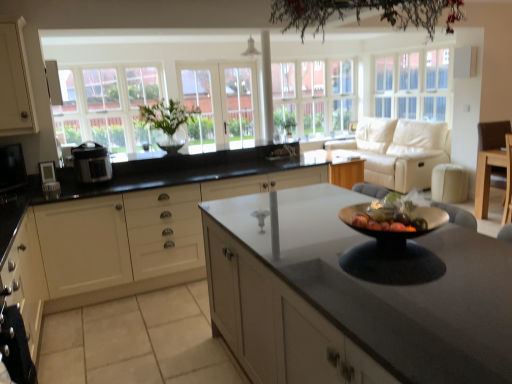
Question: Is white glass window at left, arranged as the third window when viewed from the right, facing towards matte black microwave at left, positioned as the second appliance in right-to-left order?

Choices:
 (A) no
 (B) yes

Answer: (B)

Question: From a real-world perspective, is white glass window at left, positioned as the 1th window in left-to-right order, beneath matte black microwave at left, positioned as the second appliance in right-to-left order?

Choices:
 (A) yes
 (B) no

Answer: (B)

Question: Is the position of white glass window at left, positioned as the 1th window in left-to-right order, more distant than that of matte black microwave at left, positioned as the second appliance in right-to-left order?

Choices:
 (A) yes
 (B) no

Answer: (A)

Question: Considering the relative sizes of white glass window at left, arranged as the third window when viewed from the right, and matte black microwave at left, the 1th appliance when ordered from left to right, in the image provided, is white glass window at left, arranged as the third window when viewed from the right, smaller than matte black microwave at left, the 1th appliance when ordered from left to right,?

Choices:
 (A) no
 (B) yes

Answer: (A)

Question: Can you confirm if white glass window at left, positioned as the 1th window in left-to-right order, is wider than matte black microwave at left, the 1th appliance when ordered from left to right?

Choices:
 (A) yes
 (B) no

Answer: (A)

Question: Considering the positions of white glass window at upper right, acting as the 1th window starting from the right, and green leafy plant at center in the image, is white glass window at upper right, acting as the 1th window starting from the right, taller or shorter than green leafy plant at center?

Choices:
 (A) tall
 (B) short

Answer: (A)

Question: Is point (437, 105) closer or farther from the camera than point (279, 129)?

Choices:
 (A) closer
 (B) farther

Answer: (B)

Question: Based on their sizes in the image, would you say white glass window at upper right, which is the third window in left-to-right order, is bigger or smaller than green leafy plant at center?

Choices:
 (A) big
 (B) small

Answer: (A)

Question: Is white glass window at upper right, acting as the 1th window starting from the right, inside the boundaries of green leafy plant at center, or outside?

Choices:
 (A) inside
 (B) outside

Answer: (B)

Question: Is point (432, 107) closer or farther from the camera than point (2, 188)?

Choices:
 (A) closer
 (B) farther

Answer: (B)

Question: Is white glass window at upper right, which is the third window in left-to-right order, inside or outside of matte black microwave at left, the 1th appliance when ordered from left to right?

Choices:
 (A) outside
 (B) inside

Answer: (A)

Question: Based on their sizes in the image, would you say white glass window at upper right, which is the third window in left-to-right order, is bigger or smaller than matte black microwave at left, positioned as the second appliance in right-to-left order?

Choices:
 (A) big
 (B) small

Answer: (A)

Question: Is white glass window at upper right, acting as the 1th window starting from the right, taller or shorter than matte black microwave at left, the 1th appliance when ordered from left to right?

Choices:
 (A) tall
 (B) short

Answer: (A)

Question: In the image, is light brown wood chair at right positioned in front of or behind clear glass window at center, marked as the 2th window in a right-to-left arrangement?

Choices:
 (A) front
 (B) behind

Answer: (A)

Question: Visually, is light brown wood chair at right positioned to the left or to the right of clear glass window at center, which is the second window from left to right?

Choices:
 (A) left
 (B) right

Answer: (B)